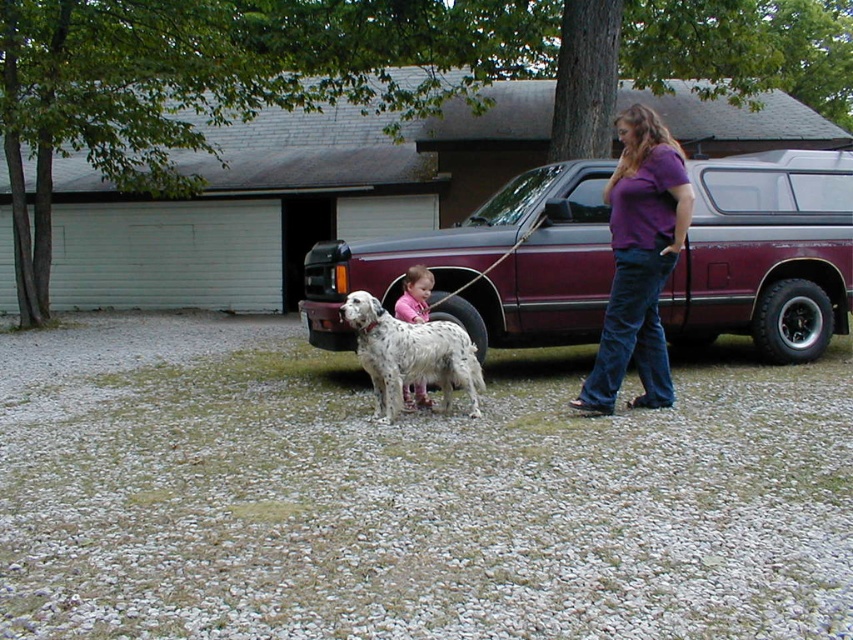
You are standing in the yard and want to walk to the garage door. The maroon metallic pickup truck at center is blocking your path. Can you estimate how far you need to walk around the truck to reach the garage door?

The maroon metallic pickup truck at center is located at point (486, 266). To reach the garage door, you would need to walk around the truck either to the left or right side. The exact distance depends on the truck and garage dimensions, but a rough estimate would be approximately 2 meters to go around it safely.

You are a delivery person trying to determine if the maroon metallic pickup truck at center can fit through a standard doorway. Considering the white speckled fur dog at center is 0.5 meters tall, can the truck pass through the doorway which is 2 meters in height?

The maroon metallic pickup truck at center is taller than the white speckled fur dog at center. Since the dog is 0.5 meters tall, the truck is taller than 0.5 meters. However, the exact height of the truck is not provided, so we cannot definitively determine if it can pass through a 2 meter doorway. More information about the truck height is needed.